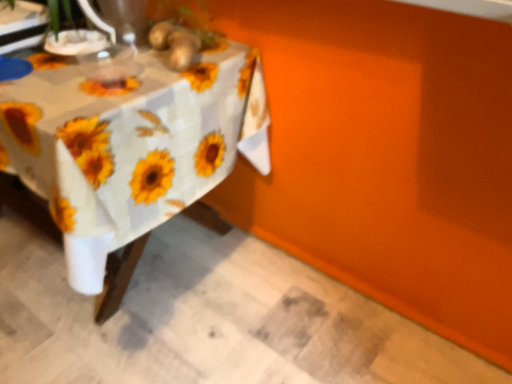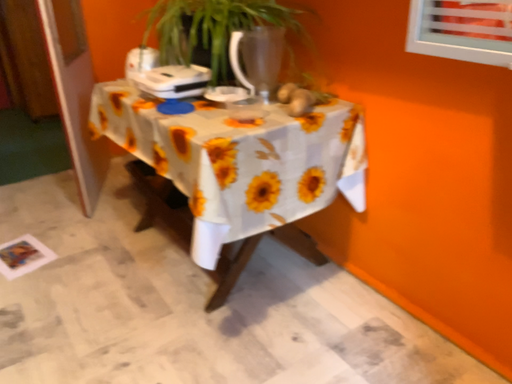
Question: Which way did the camera rotate in the video?

Choices:
 (A) rotated downward
 (B) rotated upward

Answer: (B)